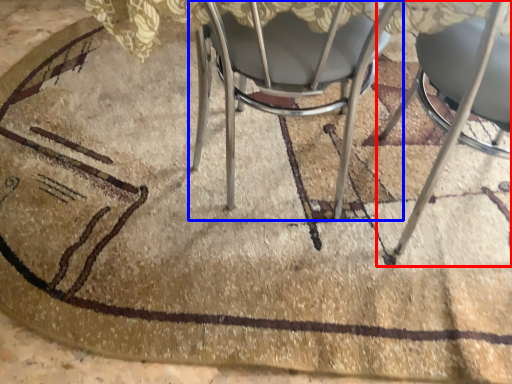
Question: Which object appears farthest to the camera in this image, chair (highlighted by a red box) or chair (highlighted by a blue box)?

Choices:
 (A) chair
 (B) chair

Answer: (B)